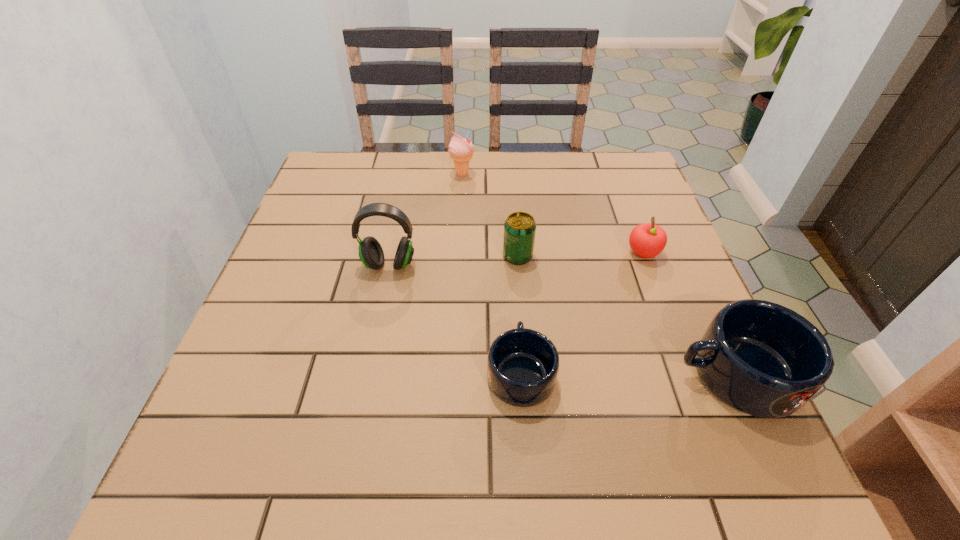
Where is `free space between the fifth shortest object and the right mug`? free space between the fifth shortest object and the right mug is located at coordinates (599, 274).

Where is `vacant area between the right mug and the second tallest object`? This screenshot has height=540, width=960. vacant area between the right mug and the second tallest object is located at coordinates (599, 274).

Locate an element on the screen. The height and width of the screenshot is (540, 960). free space between the left mug and the apple is located at coordinates (582, 313).

Where is `vacant space that's between the leftmost object and the right mug`? The height and width of the screenshot is (540, 960). vacant space that's between the leftmost object and the right mug is located at coordinates (563, 320).

Where is `vacant space that's between the beer can and the taller mug`? vacant space that's between the beer can and the taller mug is located at coordinates (627, 315).

The image size is (960, 540). I want to click on free point between the left mug and the second tallest object, so click(492, 273).

Locate an element on the screen. The image size is (960, 540). object that is the third closest to the fifth shortest object is located at coordinates tap(647, 240).

This screenshot has height=540, width=960. I want to click on object that is the fifth closest one to the apple, so click(371, 254).

This screenshot has height=540, width=960. I want to click on vacant space that satisfies the following two spatial constraints: 1. on the back side of the beer can; 2. on the left side of the apple, so click(517, 253).

You are a GUI agent. You are given a task and a screenshot of the screen. Output one action in this format:
    pyautogui.click(x=<x>, y=<y>)
    Task: Click on the free region that satisfies the following two spatial constraints: 1. with the handle on the side of the apple; 2. on the right side of the shorter mug
    This screenshot has height=540, width=960.
    Given the screenshot: What is the action you would take?
    pyautogui.click(x=512, y=253)